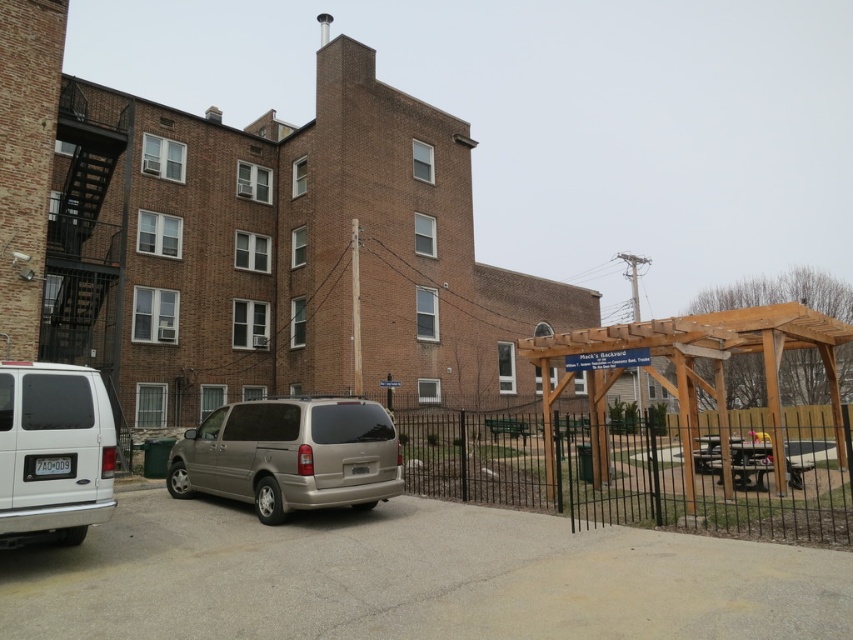
Question: Which is nearer to the gold metallic minivan at center?

Choices:
 (A) black metal fence at lower right
 (B) white matte van at lower left

Answer: (B)

Question: Considering the real-world distances, which object is closest to the white matte van at lower left?

Choices:
 (A) gold metallic minivan at center
 (B) black metal fence at lower right

Answer: (A)

Question: Which of the following is the farthest from the observer?

Choices:
 (A) (405, 442)
 (B) (167, 461)

Answer: (A)

Question: Observing the image, what is the correct spatial positioning of black metal fence at lower right in reference to gold metallic minivan at center?

Choices:
 (A) left
 (B) right

Answer: (B)

Question: Does black metal fence at lower right have a lesser width compared to gold metallic minivan at center?

Choices:
 (A) no
 (B) yes

Answer: (A)

Question: Is black metal fence at lower right thinner than gold metallic minivan at center?

Choices:
 (A) yes
 (B) no

Answer: (B)